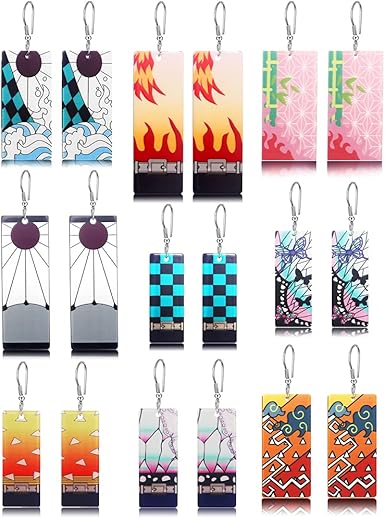
At what (x,y) coordinates should I click in order to perform the action: click on hook. Please return your answer as a coordinate pair (x, y). This screenshot has height=517, width=385. Looking at the image, I should click on (x=216, y=382).